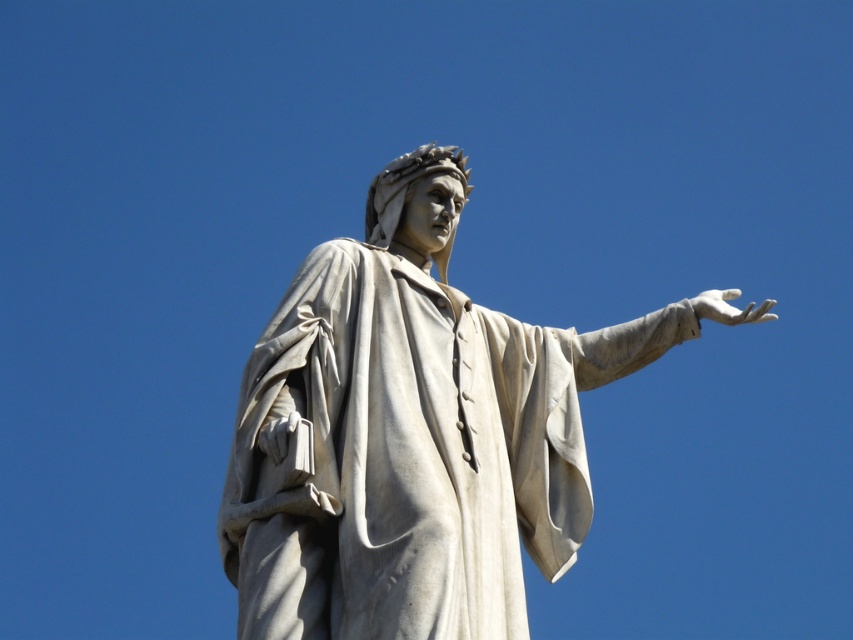
Between white marble statue at center and white marble hand at right, which one appears on the right side from the viewer's perspective?

white marble hand at right is more to the right.

Is white marble statue at center smaller than white marble hand at right?

Yes, white marble statue at center is smaller than white marble hand at right.

Is point (279, 384) behind point (728, 314)?

No, (279, 384) is closer to viewer.

Where is `white marble statue at center`? Image resolution: width=853 pixels, height=640 pixels. white marble statue at center is located at coordinates (412, 435).